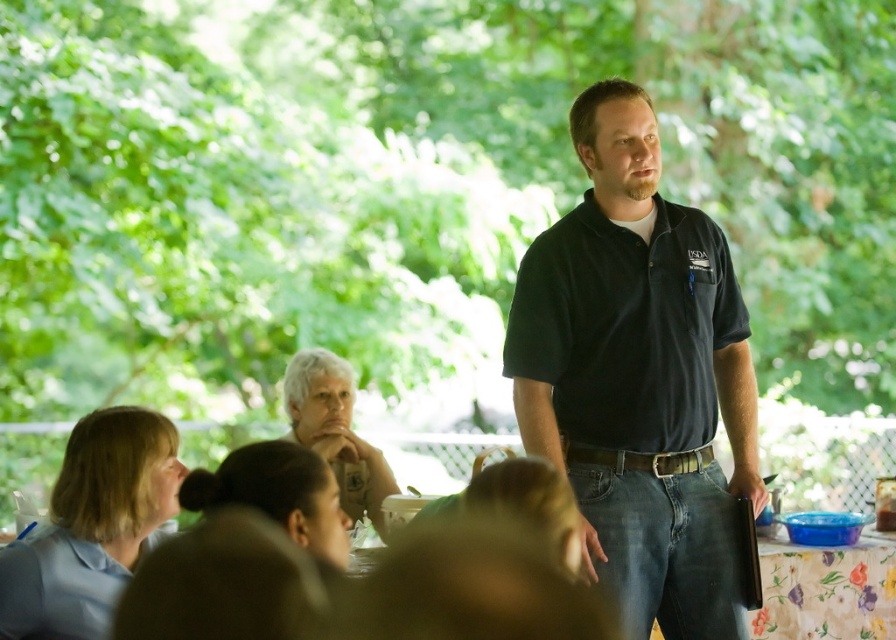
Is point (729, 560) farther from viewer compared to point (849, 595)?

No, (729, 560) is in front of (849, 595).

Which of these two, dark blue shirt at center or floral fabric tablecloth at lower right, stands taller?

dark blue shirt at center is taller.

Is point (547, 406) closer to viewer compared to point (862, 570)?

Yes, it is in front of point (862, 570).

At what (x,y) coordinates should I click in order to perform the action: click on dark blue shirt at center. Please return your answer as a coordinate pair (x, y). The image size is (896, 640). Looking at the image, I should click on (639, 378).

Who is lower down, black cotton polo shirt at center or floral fabric tablecloth at lower right?

floral fabric tablecloth at lower right is below.

Can you confirm if black cotton polo shirt at center is wider than floral fabric tablecloth at lower right?

Yes.

Between point (514, 365) and point (837, 616), which one is positioned behind?

The point (837, 616) is behind.

I want to click on black cotton polo shirt at center, so click(x=626, y=326).

Measure the distance between point (557,422) and camera.

3.45 meters

Who is higher up, dark blue shirt at center or black cotton polo shirt at center?

black cotton polo shirt at center is above.

Who is more distant from viewer, (696, 381) or (550, 294)?

Point (696, 381)

Where is `dark blue shirt at center`? The image size is (896, 640). dark blue shirt at center is located at coordinates (639, 378).